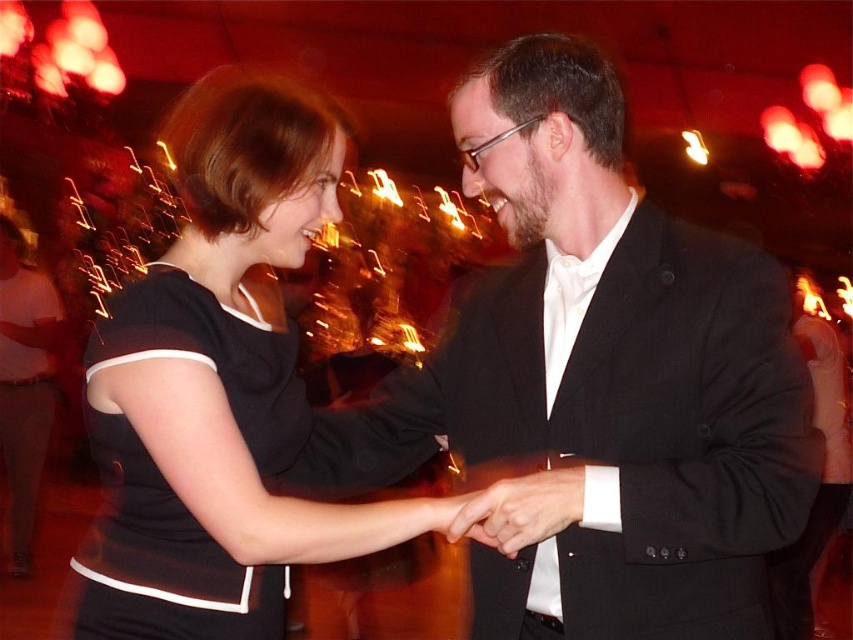
Which is more to the right, black matte dress at center or matte black hand at center?

Positioned to the right is matte black hand at center.

Is black matte dress at center above matte black hand at center?

Yes.

Where is `black matte dress at center`? black matte dress at center is located at coordinates (219, 388).

Does black jersey dress at left appear under matte black hand at center?

Actually, black jersey dress at left is above matte black hand at center.

Can you confirm if black jersey dress at left is shorter than matte black hand at center?

Incorrect, black jersey dress at left's height does not fall short of matte black hand at center's.

Which is behind, point (283, 346) or point (535, 515)?

Positioned behind is point (283, 346).

Find the location of `black jersey dress at left`. black jersey dress at left is located at coordinates (161, 557).

Locate an element on the screen. This screenshot has width=853, height=640. black suit at center is located at coordinates (602, 378).

Does point (589, 524) come farther from viewer compared to point (222, 276)?

No.

Who is more forward, [538,292] or [247,205]?

Positioned in front is point [247,205].

The image size is (853, 640). I want to click on black suit at center, so click(602, 378).